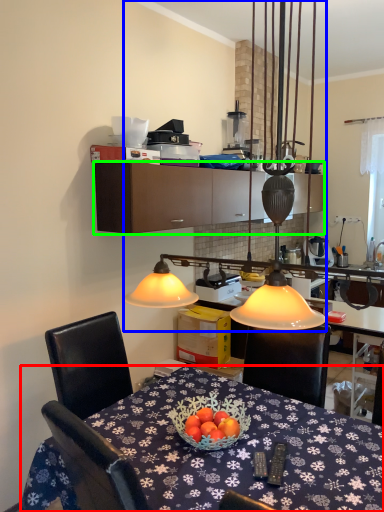
Question: Which object is positioned farthest from desk (highlighted by a red box)? Select from lamp (highlighted by a blue box) and cabinetry (highlighted by a green box).

Choices:
 (A) lamp
 (B) cabinetry

Answer: (B)